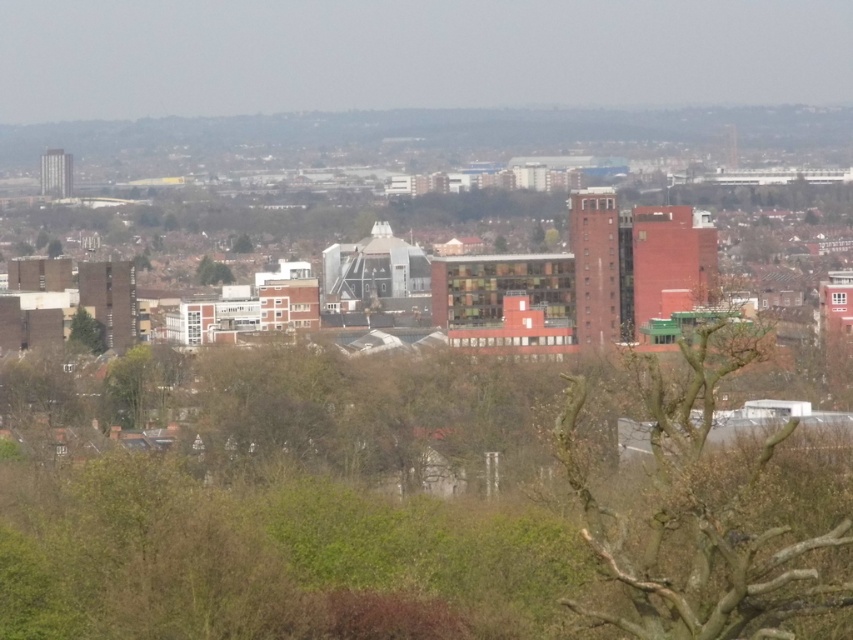
You are an urban planner assessing the cityscape. You notice the bare branches at center and the green leafy tree at upper center. Which tree would cast a larger shadow during midday when the sun is directly overhead?

The bare branches at center has a greater height compared to the green leafy tree at upper center. Since taller objects cast larger shadows, the bare branches at center would cast a larger shadow during midday.

You are a city planner assessing the urban layout. You need to install a new public bench equidistant between the green leafy tree at lower left and the green leafy tree at upper center. What is the minimum distance the bench should be placed from each tree?

The bench should be placed 16.665 meters away from each tree to be equidistant between them.

You are standing in the urban landscape shown in the image and want to walk towards both the green leafy tree at lower left and the green leafy tree at upper center. Which tree will you reach first?

You will reach the green leafy tree at lower left first because it is closer to you than the green leafy tree at upper center, which is further away.